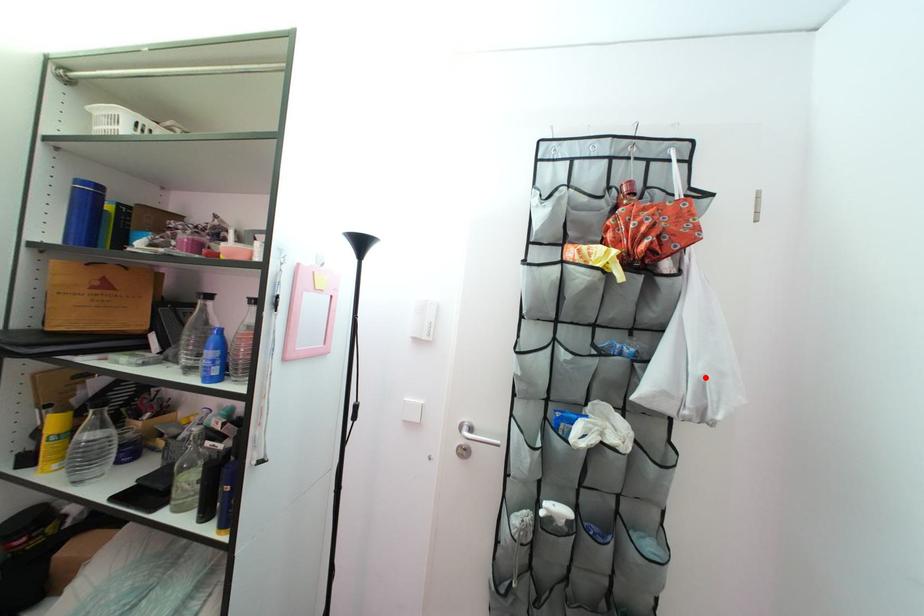
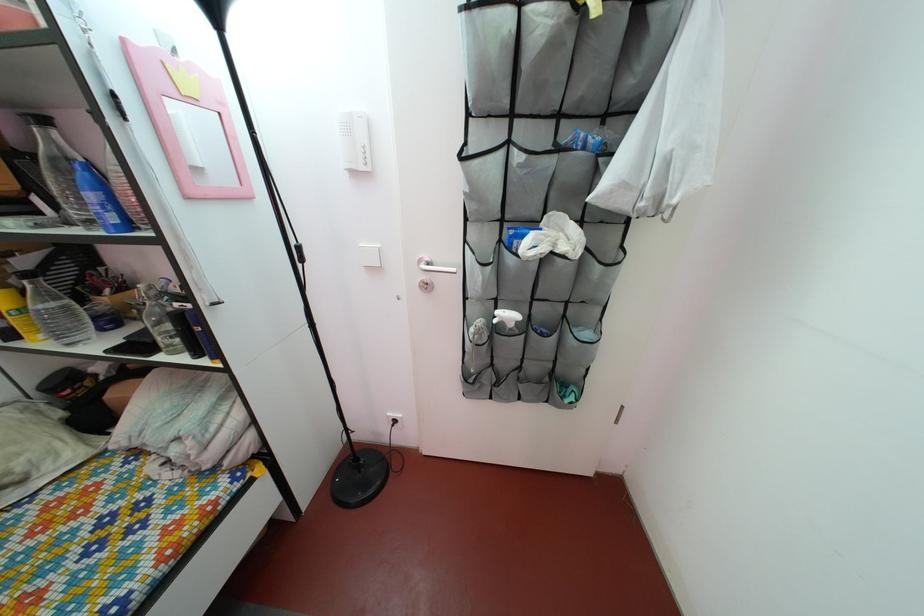
The point at the highlighted location is marked in the first image. Where is the corresponding point in the second image?

(675, 152)